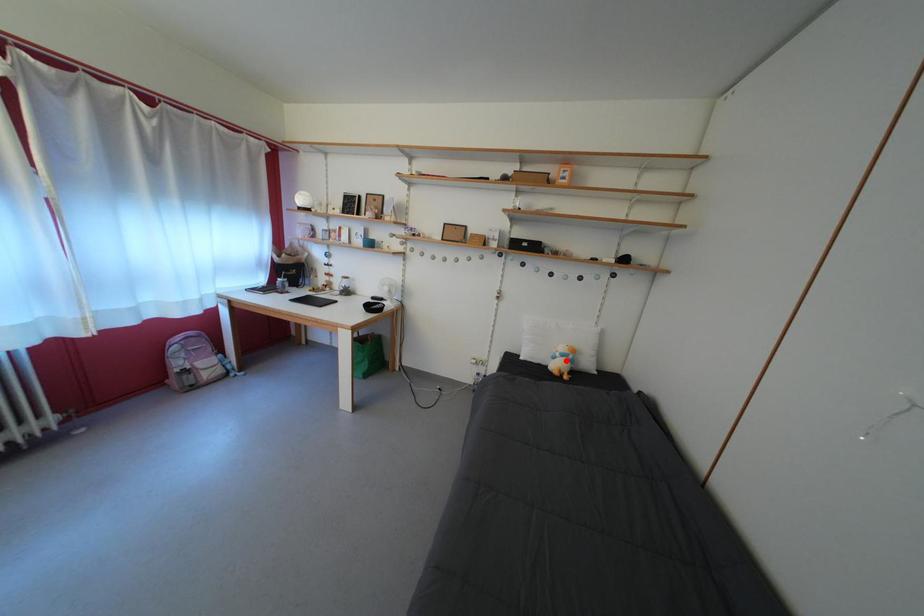
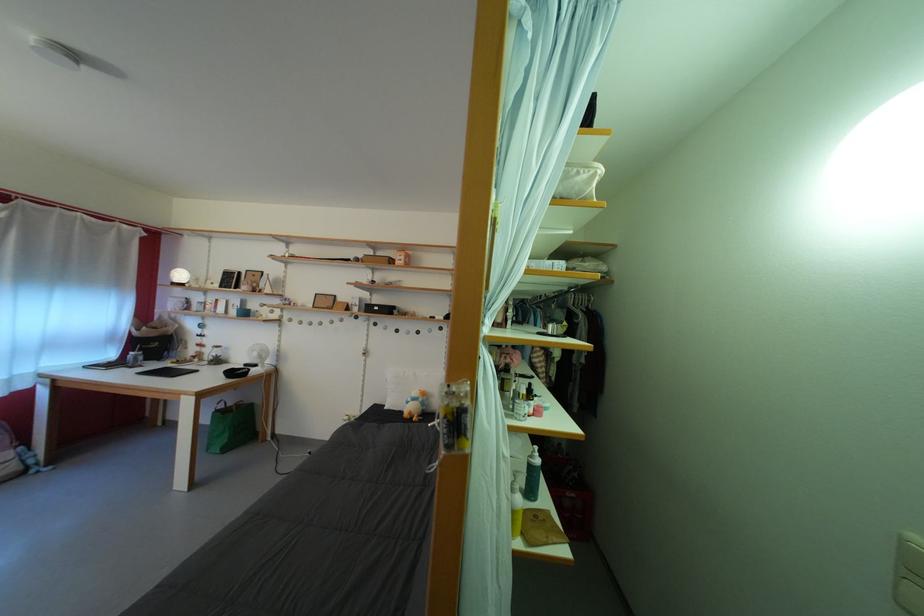
Locate, in the second image, the point that corresponds to the highlighted location in the first image.

(418, 405)